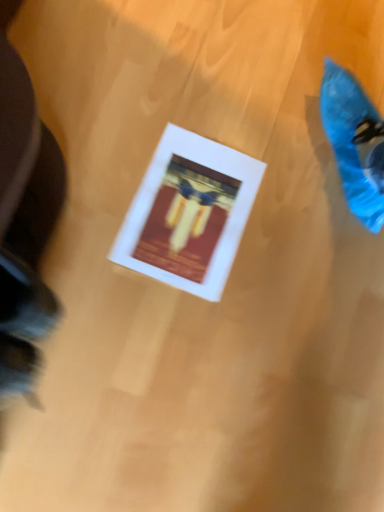
What is the approximate height of white matte picture frame at center?

1.09 inches.

What do you see at coordinates (189, 213) in the screenshot? I see `white matte picture frame at center` at bounding box center [189, 213].

Identify the location of white matte picture frame at center. (189, 213).

Find the location of a particular element. The image size is (384, 512). white matte picture frame at center is located at coordinates (189, 213).